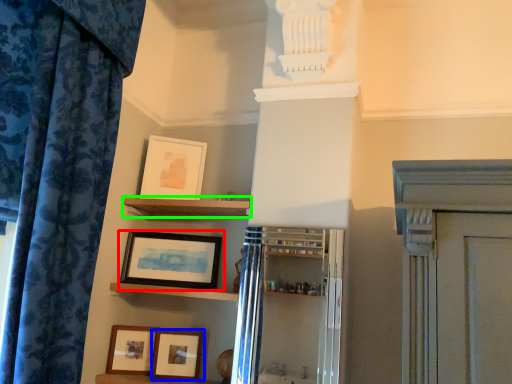
Question: Which is nearer to the picture frame (highlighted by a red box)? picture frame (highlighted by a blue box) or shelf (highlighted by a green box).

Choices:
 (A) picture frame
 (B) shelf

Answer: (B)